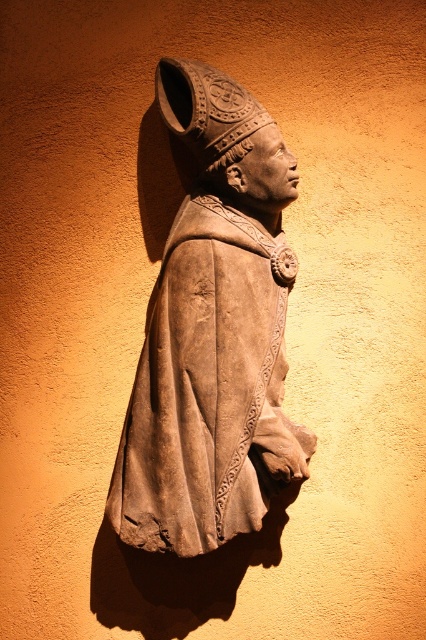
You are an art conservator examining the brown stone statue at center and the brown stone head at center. Which object would require a larger protective covering to fully enclose it?

The brown stone statue at center requires a larger protective covering because it is bigger than the brown stone head at center.

You are an art conservator examining the sculpture. You notice two parts of the sculpture labeled as the brown stone statue at center and the brown stone head at center. Which part is positioned lower in the sculpture?

The brown stone statue at center is positioned lower than the brown stone head at center, as it is located below it.

You are a photographer standing in front of the brown stone statue at center. You want to take a photo that captures the statue and the textured wall behind it without any distortion. What is the minimum distance you should maintain from the statue to ensure clarity?

The minimum distance you should maintain from the brown stone statue at center is 1.76 meters to ensure clarity and avoid distortion, as this is the distance the statue is positioned from the camera.